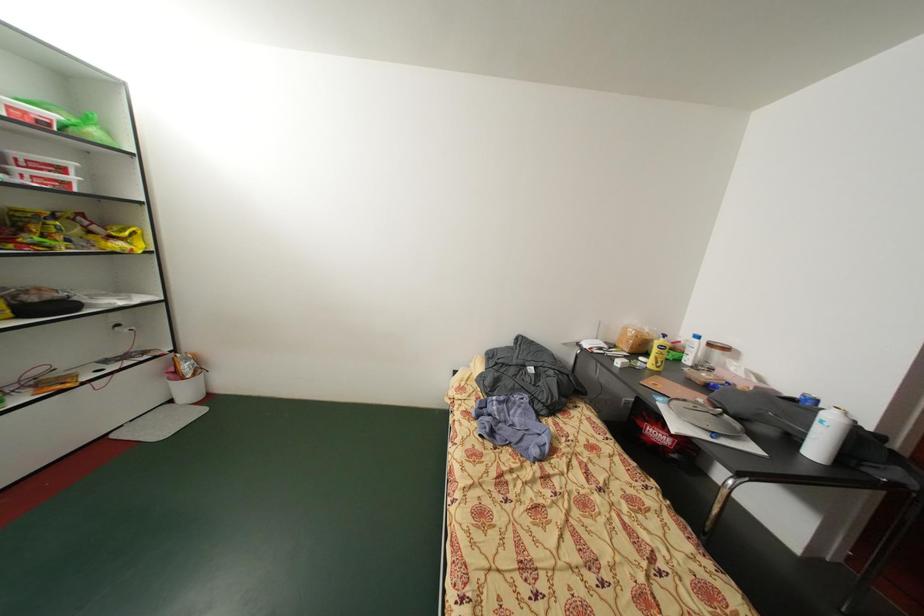
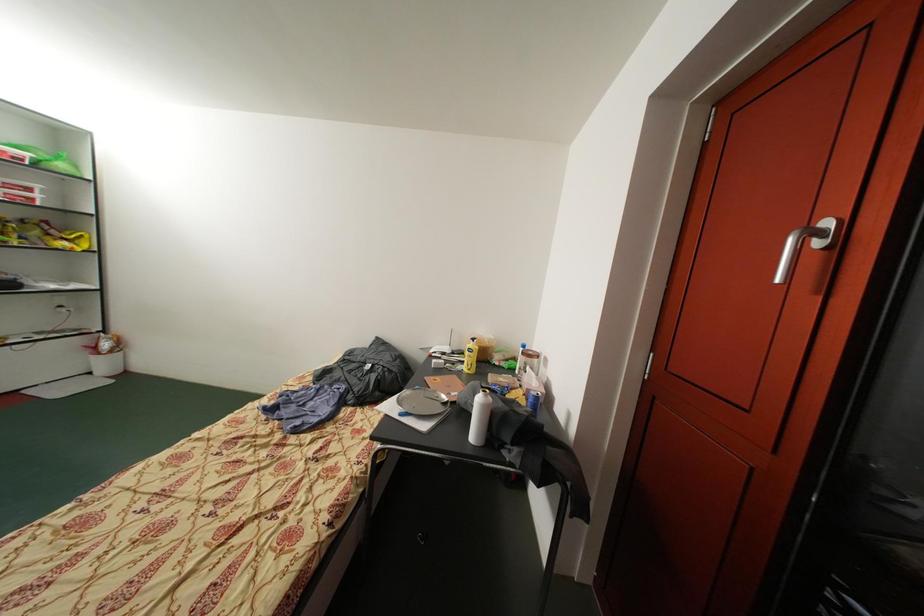
Question: What movement of the cameraman would produce the second image?

Choices:
 (A) Left
 (B) Right
 (C) Forward
 (D) Backward

Answer: (B)